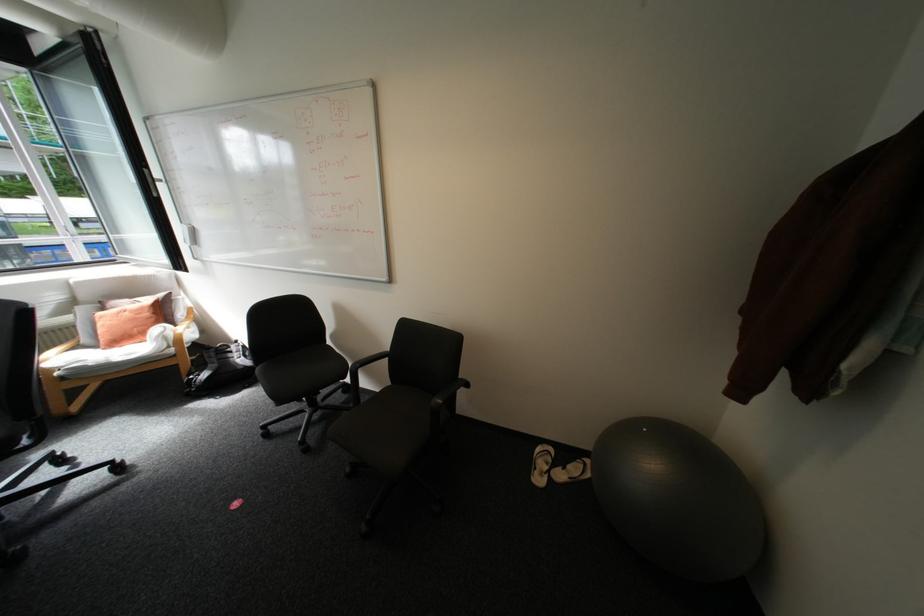
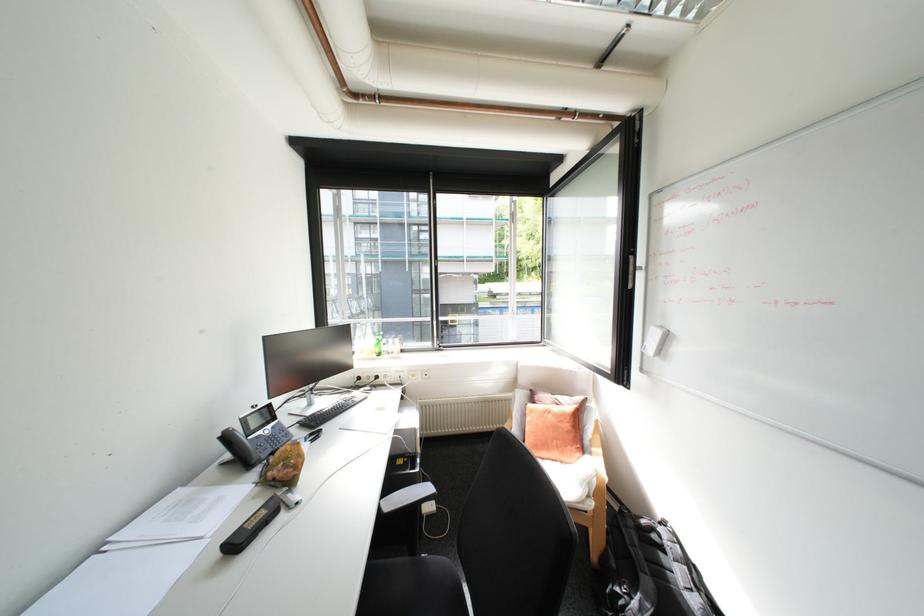
The point at (209, 375) is marked in the first image. Where is the corresponding point in the second image?

(640, 598)